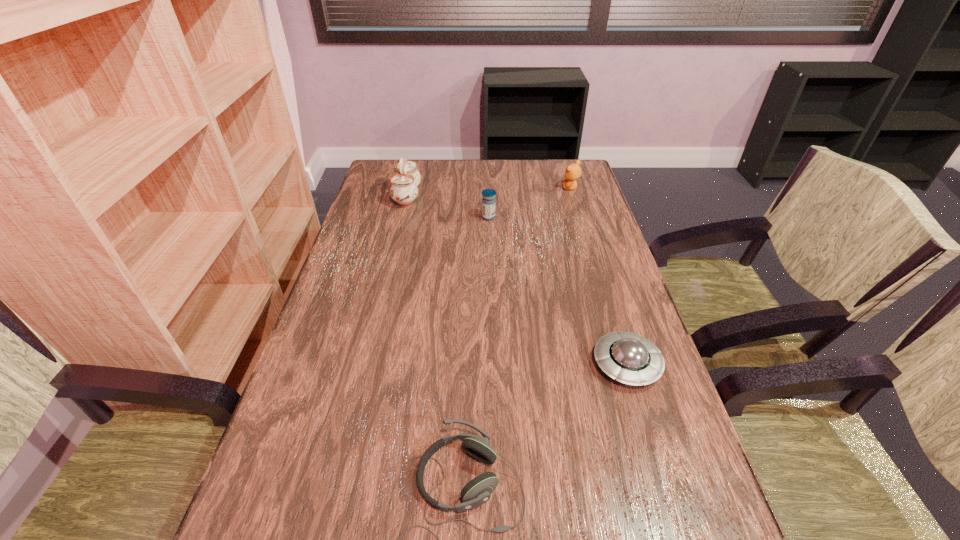
At what (x,y) coordinates should I click in order to perform the action: click on free space that satisfies the following two spatial constraints: 1. by the handle of the third nearest object; 2. on the left side of the leftmost object. Please return your answer as a coordinate pair (x, y). The height and width of the screenshot is (540, 960). Looking at the image, I should click on (402, 217).

Where is `free region that satisfies the following two spatial constraints: 1. by the handle of the tallest object; 2. on the right side of the second nearest object`? This screenshot has height=540, width=960. free region that satisfies the following two spatial constraints: 1. by the handle of the tallest object; 2. on the right side of the second nearest object is located at coordinates (367, 364).

Locate an element on the screen. vacant space that satisfies the following two spatial constraints: 1. by the handle of the third nearest object; 2. on the left side of the leftmost object is located at coordinates (402, 217).

You are a GUI agent. You are given a task and a screenshot of the screen. Output one action in this format:
    pyautogui.click(x=<x>, y=<y>)
    Task: Click on the free spot that satisfies the following two spatial constraints: 1. by the handle of the chinaware; 2. on the right side of the third farthest object
    This screenshot has height=540, width=960.
    Given the screenshot: What is the action you would take?
    pyautogui.click(x=402, y=217)

In order to click on vacant area in the image that satisfies the following two spatial constraints: 1. by the handle of the saucer; 2. on the left side of the chinaware in this screenshot , I will do `click(367, 364)`.